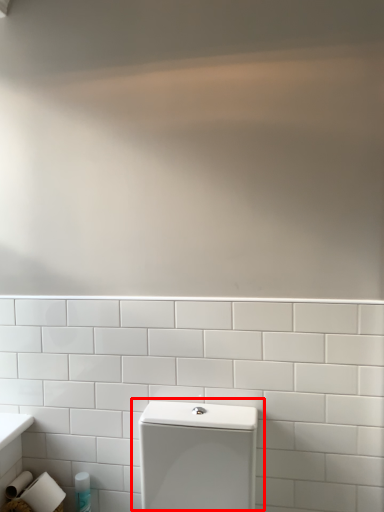
Question: From the image's perspective, where is toilet (annotated by the red box) located in relation to toiletry in the image?

Choices:
 (A) below
 (B) above

Answer: (B)